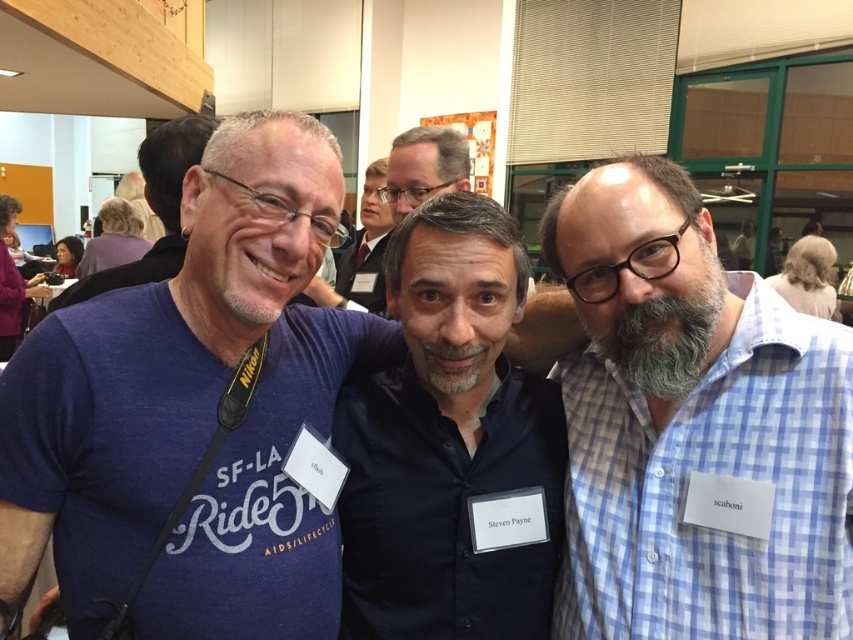
Who is lower down, dark blue shirt at center or matte black shirt at center?

dark blue shirt at center is lower down.

The height and width of the screenshot is (640, 853). I want to click on dark blue shirt at center, so click(450, 444).

In order to click on dark blue shirt at center in this screenshot , I will do `click(450, 444)`.

This screenshot has height=640, width=853. In order to click on dark blue shirt at center in this screenshot , I will do `click(450, 444)`.

Between blue checkered shirt at right and dark blue shirt at center, which one has less height?

dark blue shirt at center is shorter.

The height and width of the screenshot is (640, 853). Describe the element at coordinates (693, 428) in the screenshot. I see `blue checkered shirt at right` at that location.

Who is more distant from viewer, (543, 241) or (387, 275)?

The point (543, 241) is behind.

Locate an element on the screen. This screenshot has height=640, width=853. blue checkered shirt at right is located at coordinates (693, 428).

Which is above, matte blue t-shirt at center or matte black shirt at center?

matte black shirt at center is higher up.

Does point (42, 394) lie in front of point (363, 228)?

That is True.

In order to click on matte blue t-shirt at center in this screenshot , I will do `click(192, 413)`.